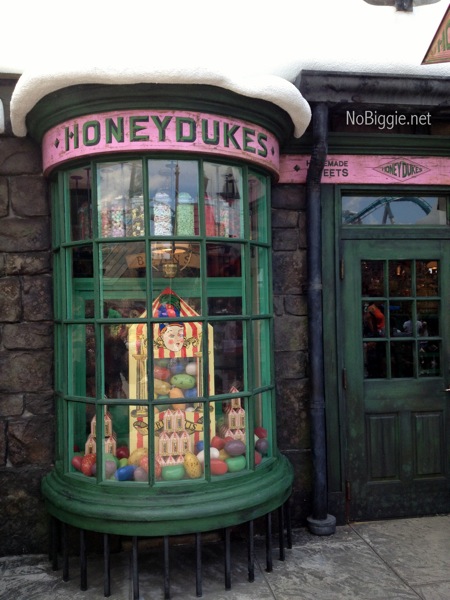
Identify the location of bow window. (204, 237).